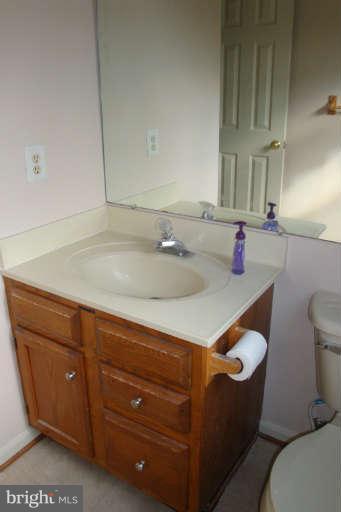
The height and width of the screenshot is (512, 341). Find the location of `sink`. sink is located at coordinates (140, 276).